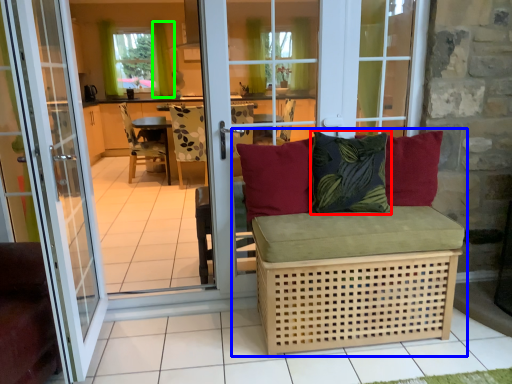
Question: Estimate the real-world distances between objects in this image. Which object is farther from pillow (highlighted by a red box), studio couch (highlighted by a blue box) or curtain (highlighted by a green box)?

Choices:
 (A) studio couch
 (B) curtain

Answer: (B)